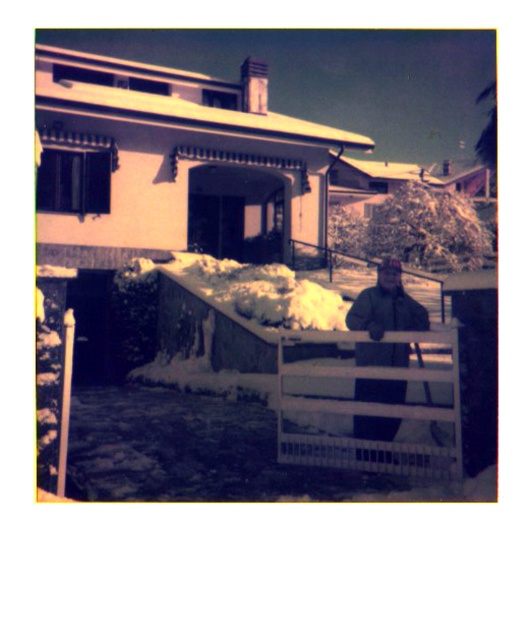
You are standing in front of the house and see the white matte fence at center and the green matte jacket at center. Which object is located to the left of the other?

The white matte fence at center is positioned on the left side of green matte jacket at center.

You are standing at the entrance of the house and want to see the white matte fence at center. Based on its 2D coordinates, in which direction should you look to see it?

The white matte fence at center is located at 2D coordinates point [369,406], so you should look towards the center of the image to see it.